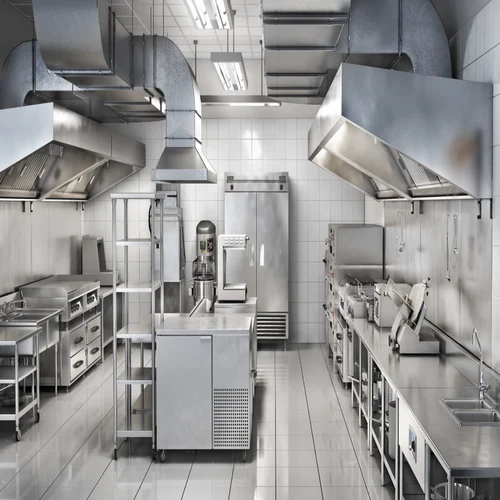
The width and height of the screenshot is (500, 500). I want to click on cabinet, so click(281, 290).